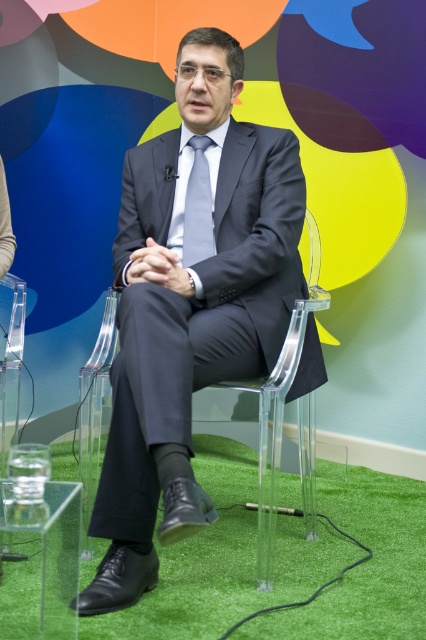
You are standing in a room with a man in a dark gray suit seated on a transparent chair. There are two points marked in the scene. Based on their positions, which point is farther away from you, point (26,122) or point (164,362)?

Point (26,122) is behind point (164,362), so it is farther away from you.

You are an interior designer planning to place a matte gray tie at center on a shelf next to a matte plastic chair at center. If the shelf has a width of 1 meter, will both items fit side by side?

The matte plastic chair at center is wider than the matte gray tie at center. However, since the shelf is 1 meter wide, both items can fit side by side as their combined width is less than the shelf length.